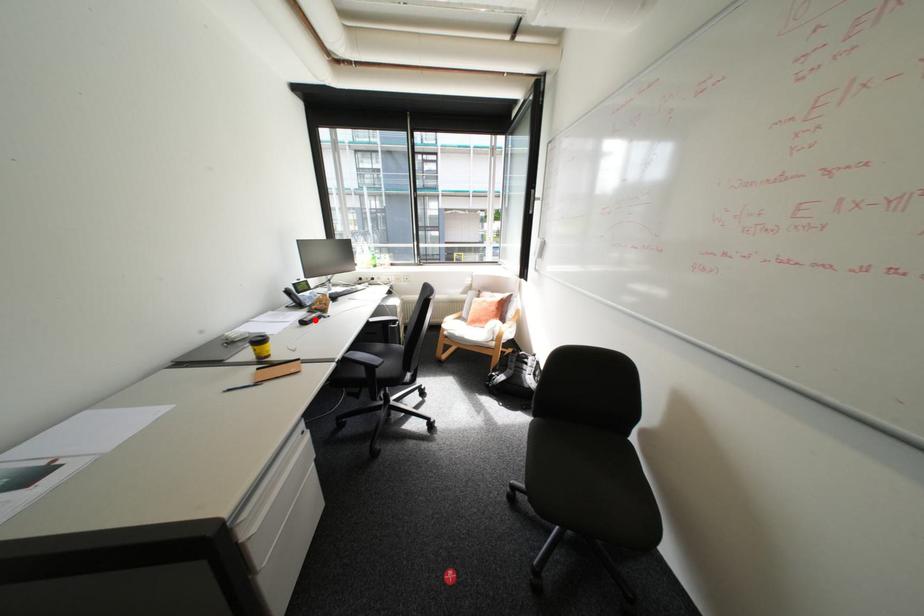
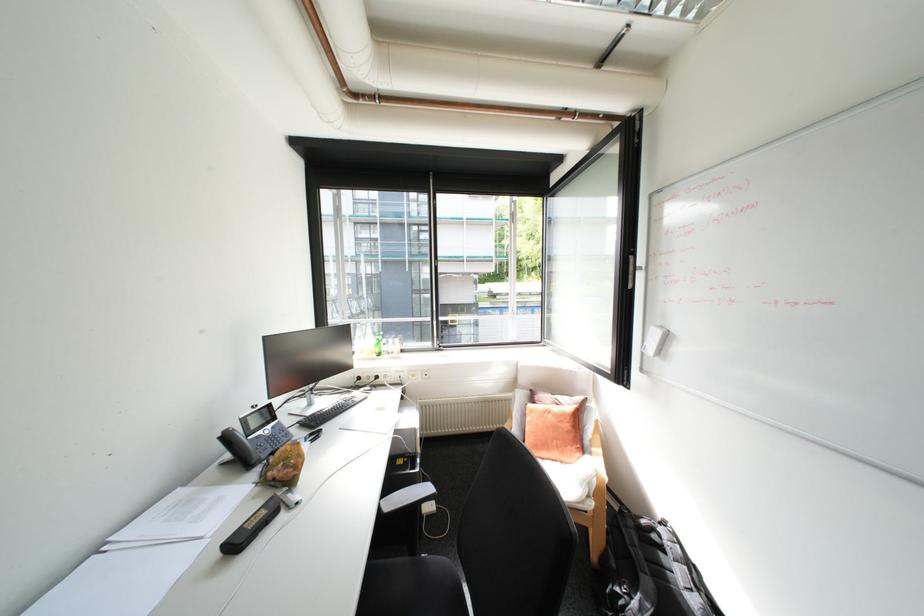
Locate, in the second image, the point that corresponds to the highlighted location in the first image.

(248, 539)